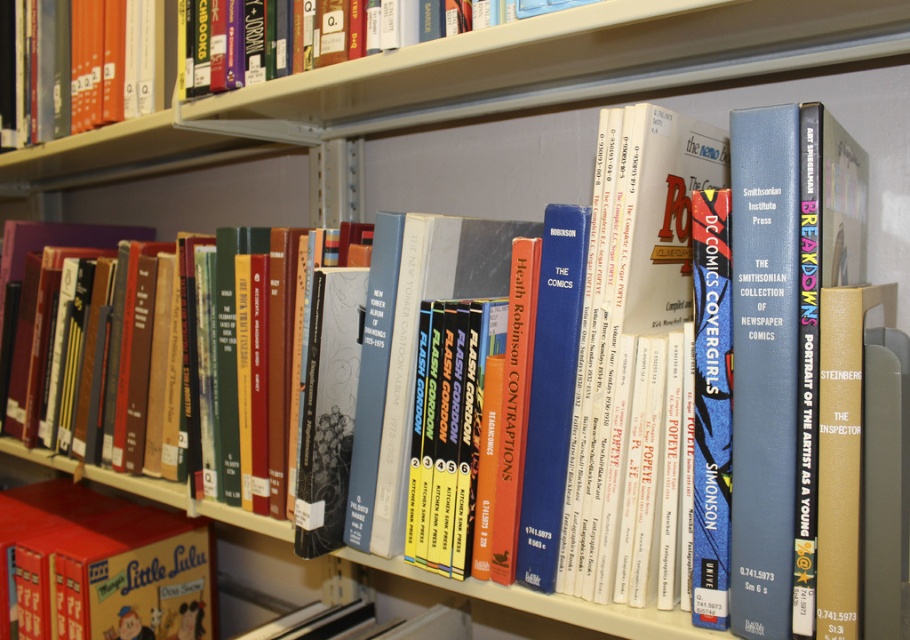
You are a librarian who needs to place a new book on the shelf. The new book is exactly 3 feet wide. Can you fit it between the matte red book at lower left and the nearest shelf edge?

The distance between the matte red book at lower left and the nearest shelf edge is 3.48 feet, which is wider than the new book. Therefore, the book can fit.

You are standing in front of the bookshelf and want to reach two points on the shelf. One is at point (44, 508) and the other at point (119, 81). Which point is closer to you?

Point (44, 508) is further to the camera than point (119, 81), so the point at (119, 81) is closer to you.